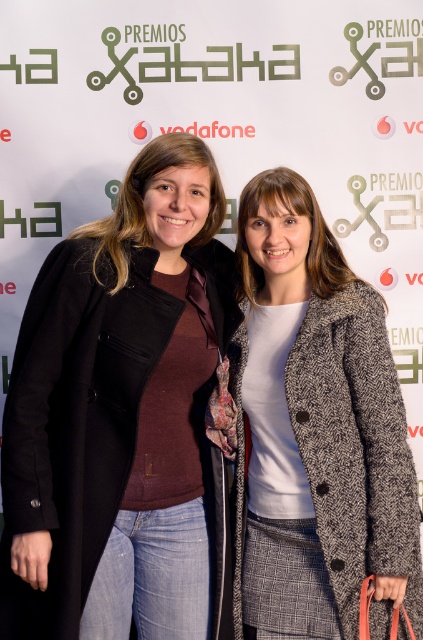
You are at an awards ceremony and need to find the person wearing the matte black coat at center. Based on the scene description, which direction should you look relative to the white textured coat at center?

The matte black coat at center is to the left of the white textured coat at center, so you should look to the left of the white textured coat at center to find the person wearing the matte black coat at center.

You are a photographer at the event and need to adjust the lighting to ensure both coats are visible. Since the matte black coat at center and the white textured coat at center are positioned in a way that one might cast a shadow on the other, which coat is more likely to cast a shadow on the other?

The matte black coat at center is located above the white textured coat at center, so it is more likely to cast a shadow on the white textured coat at center.